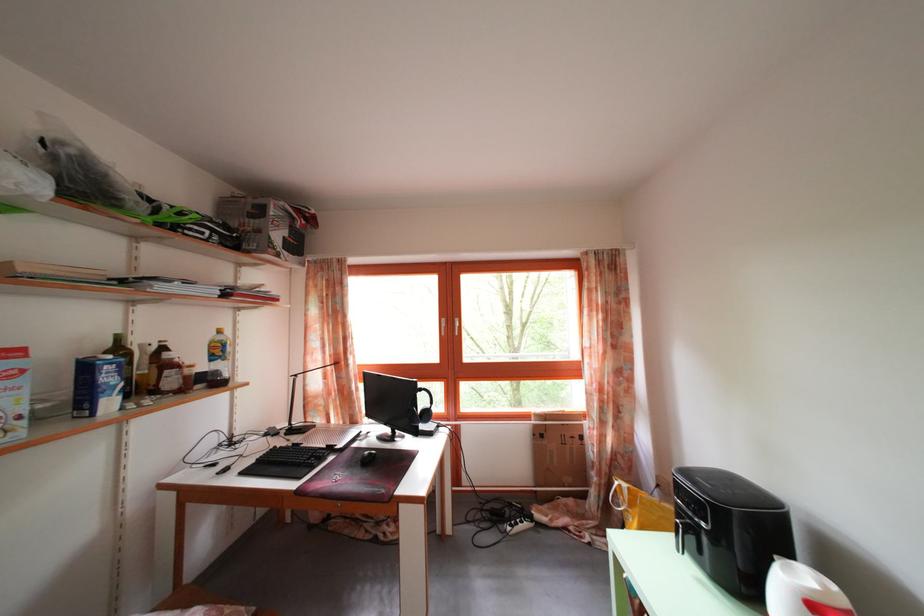
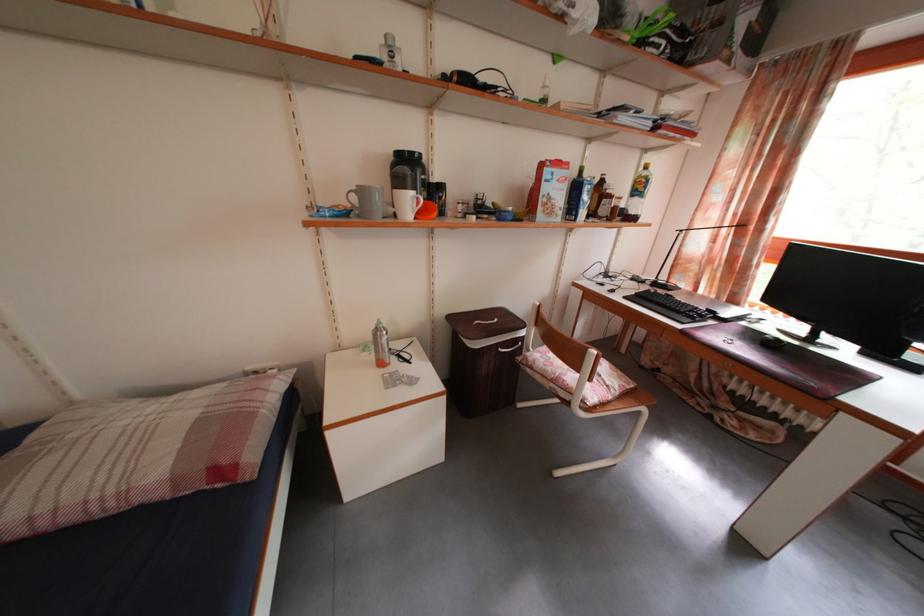
Where in the second image is the point corresponding to (x=236, y=320) from the first image?

(643, 161)